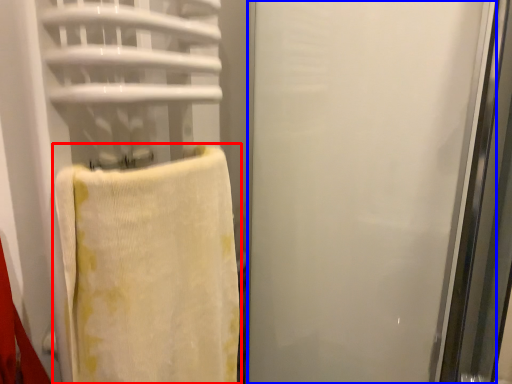
Question: Which of the following is the closest to the observer, towel (highlighted by a red box) or screen door (highlighted by a blue box)?

Choices:
 (A) towel
 (B) screen door

Answer: (A)